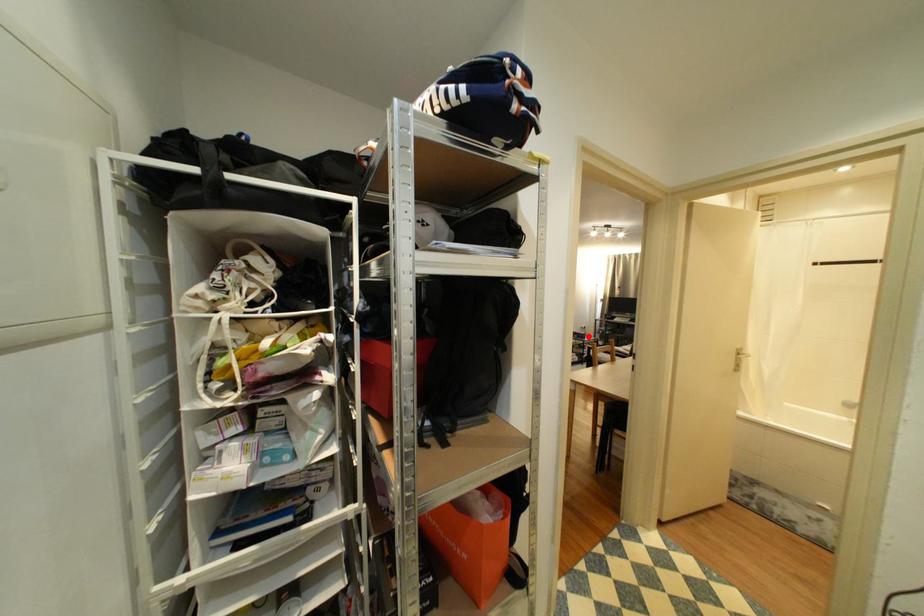
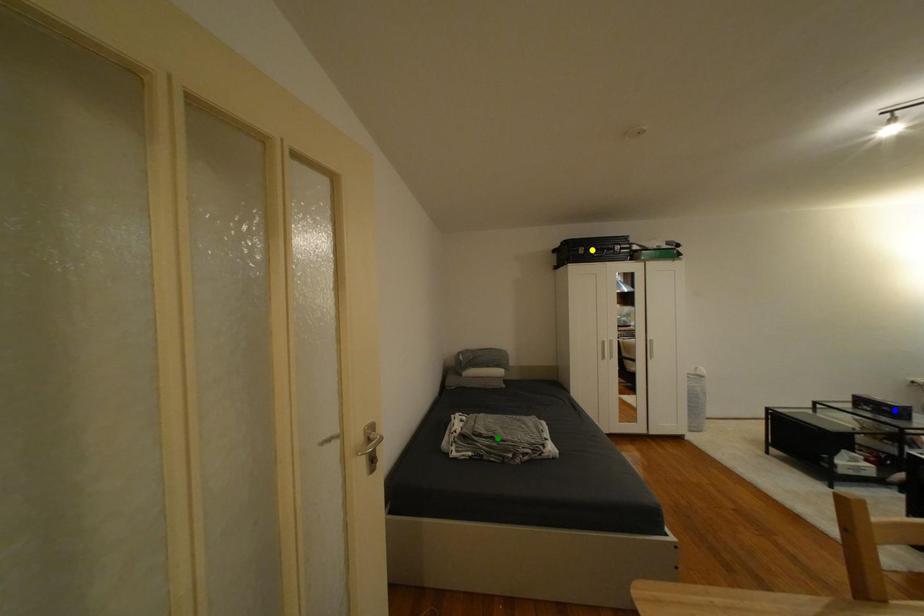
Question: I am providing you with two images of the same scene from different viewpoints. A red point is marked on the first image. You are given multiple points on the second image. Which spot in image 2 lines up with the point in image 1?

Choices:
 (A) blue point
 (B) green point
 (C) yellow point

Answer: (A)